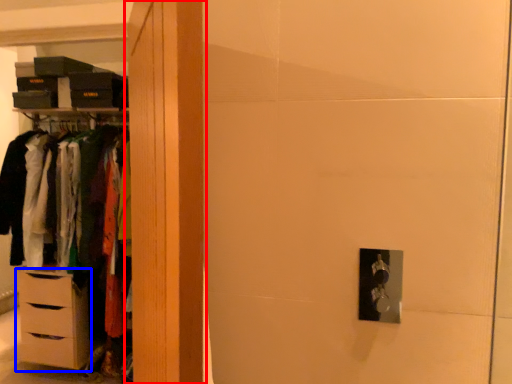
Question: Which of the following is the farthest to the observer, armoire (highlighted by a red box) or chest of drawers (highlighted by a blue box)?

Choices:
 (A) armoire
 (B) chest of drawers

Answer: (B)